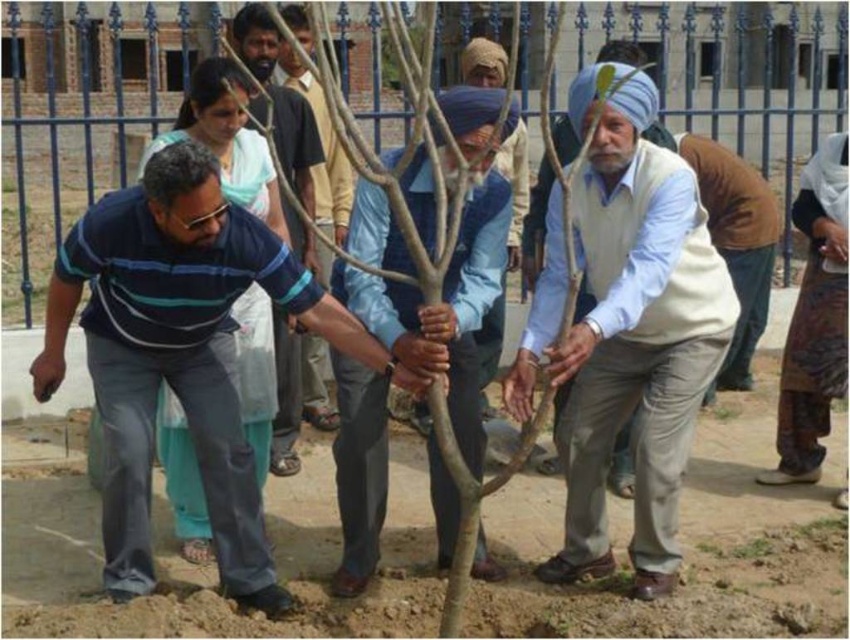
Question: Estimate the real-world distances between objects in this image. Which object is closer to the light blue fabric shirt at center?

Choices:
 (A) striped cotton shirt at center
 (B) light beige cotton shirt at center
 (C) matte blue shirt at center

Answer: (B)

Question: Which object is the closest to the matte blue shirt at center?

Choices:
 (A) striped cotton shirt at center
 (B) light beige cotton shirt at center
 (C) blue striped shirt at center

Answer: (C)

Question: Is striped cotton shirt at center further to the viewer compared to light beige cotton shirt at center?

Choices:
 (A) no
 (B) yes

Answer: (B)

Question: Can you confirm if light beige cotton shirt at center is wider than blue striped shirt at center?

Choices:
 (A) yes
 (B) no

Answer: (A)

Question: Which point is farther to the camera?

Choices:
 (A) striped cotton shirt at center
 (B) blue striped shirt at center

Answer: (B)

Question: Does light blue fabric shirt at center appear on the left side of matte blue shirt at center?

Choices:
 (A) yes
 (B) no

Answer: (B)